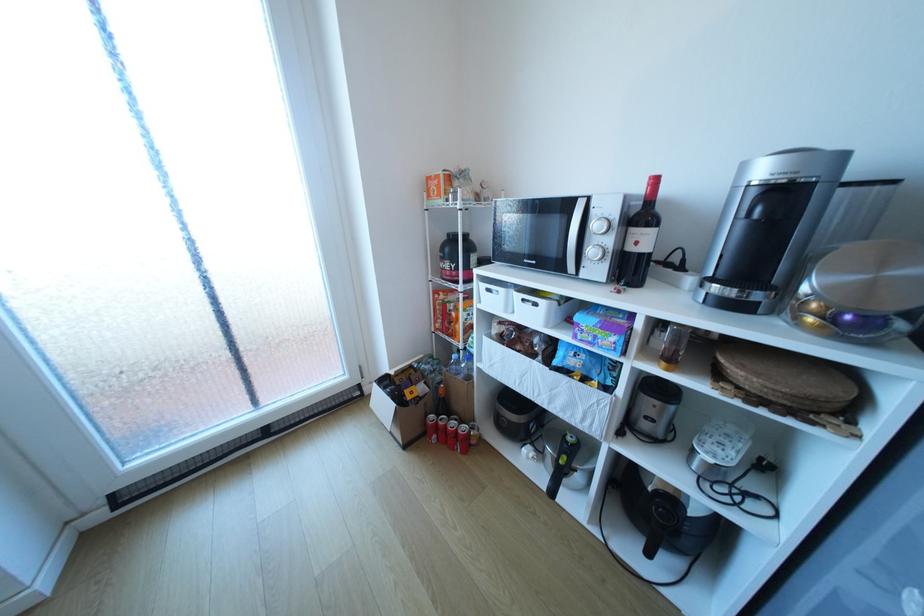
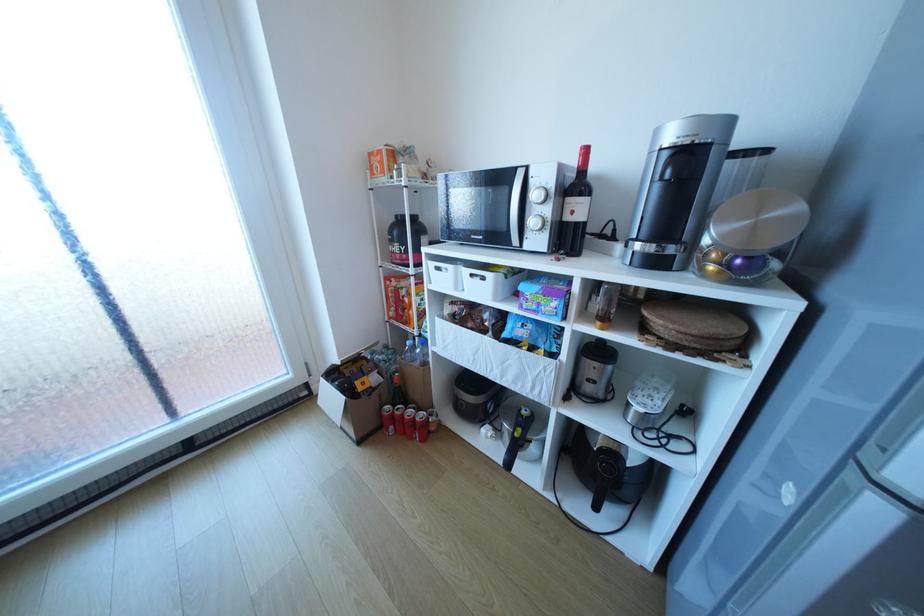
Where in the second image is the point corresponding to the point at 650,543 from the first image?

(599, 499)